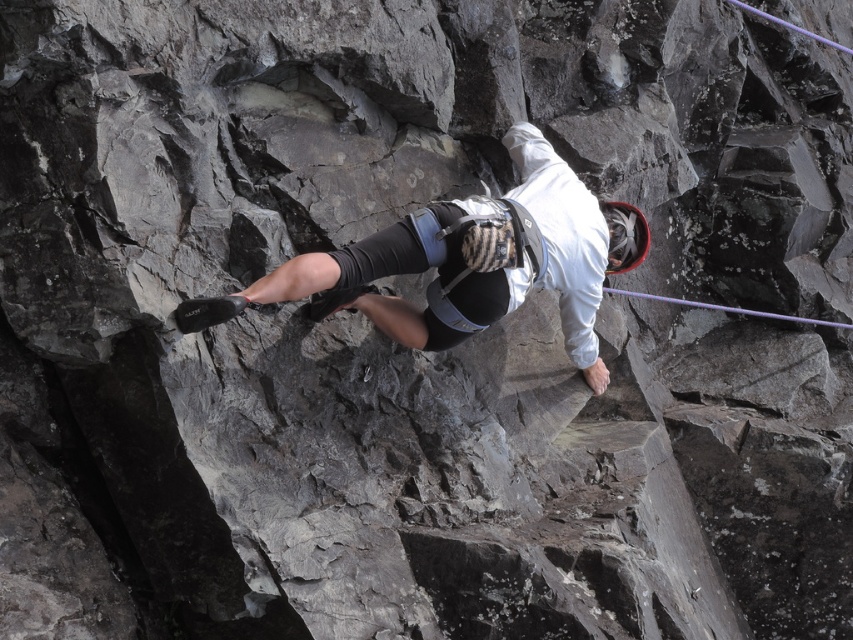
Question: Is white fabric helmet at center below purple synthetic rope at center?

Choices:
 (A) yes
 (B) no

Answer: (B)

Question: Which of the following is the closest to the observer?

Choices:
 (A) white fabric helmet at center
 (B) purple synthetic rope at center

Answer: (A)

Question: Does white fabric helmet at center appear under purple synthetic rope at center?

Choices:
 (A) no
 (B) yes

Answer: (A)

Question: Is white fabric helmet at center above purple synthetic rope at center?

Choices:
 (A) no
 (B) yes

Answer: (B)

Question: Which object appears closest to the camera in this image?

Choices:
 (A) purple synthetic rope at center
 (B) white fabric helmet at center

Answer: (B)